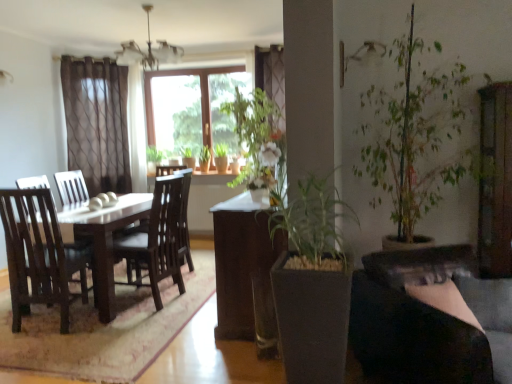
Question: Is brown wooden table at center turned away from green leafy plant at center, the 2th houseplant viewed from the right?

Choices:
 (A) no
 (B) yes

Answer: (A)

Question: Could you tell me if brown wooden table at center is facing green leafy plant at center, the 2th houseplant viewed from the right?

Choices:
 (A) yes
 (B) no

Answer: (B)

Question: Can you confirm if brown wooden table at center is bigger than green leafy plant at center, arranged as the second houseplant when ordered from the bottom?

Choices:
 (A) yes
 (B) no

Answer: (A)

Question: Is brown wooden table at center smaller than green leafy plant at center, positioned as the 1th houseplant in back-to-front order?

Choices:
 (A) no
 (B) yes

Answer: (A)

Question: Are brown wooden table at center and green leafy plant at center, placed as the 1th houseplant when sorted from left to right, far apart?

Choices:
 (A) no
 (B) yes

Answer: (B)

Question: Is green matte plant at center, acting as the 2th houseplant starting from the top, in front of or behind brown wooden table at center in the image?

Choices:
 (A) front
 (B) behind

Answer: (A)

Question: Visually, is green matte plant at center, placed as the first houseplant when sorted from bottom to top, positioned to the left or to the right of brown wooden table at center?

Choices:
 (A) right
 (B) left

Answer: (A)

Question: Based on their sizes in the image, would you say green matte plant at center, which is the first houseplant in front-to-back order, is bigger or smaller than brown wooden table at center?

Choices:
 (A) big
 (B) small

Answer: (B)

Question: Do you think green matte plant at center, acting as the 2th houseplant starting from the top, is within brown wooden table at center, or outside of it?

Choices:
 (A) outside
 (B) inside

Answer: (A)

Question: From the image's perspective, is brown wooden table at center above or below green matte plant at center, positioned as the second houseplant in left-to-right order?

Choices:
 (A) above
 (B) below

Answer: (A)

Question: Does point (216, 331) appear closer or farther from the camera than point (336, 240)?

Choices:
 (A) closer
 (B) farther

Answer: (B)

Question: From their relative heights in the image, would you say brown wooden table at center is taller or shorter than green matte plant at center, positioned as the second houseplant in left-to-right order?

Choices:
 (A) short
 (B) tall

Answer: (A)

Question: Would you say brown wooden table at center is to the left or to the right of green matte plant at center, placed as the first houseplant when sorted from bottom to top, in the picture?

Choices:
 (A) left
 (B) right

Answer: (A)

Question: Is green leafy plant at center, which appears as the first houseplant when viewed from the top, inside or outside of green matte plant at center, positioned as the second houseplant in left-to-right order?

Choices:
 (A) outside
 (B) inside

Answer: (A)

Question: From the image's perspective, relative to green matte plant at center, placed as the first houseplant when sorted from bottom to top, is green leafy plant at center, acting as the 2th houseplant starting from the front, above or below?

Choices:
 (A) below
 (B) above

Answer: (B)